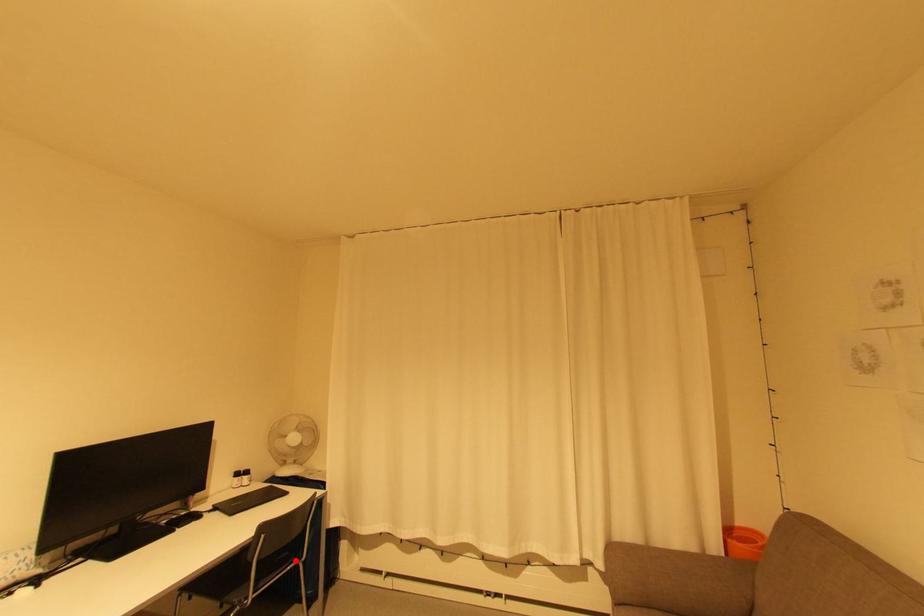
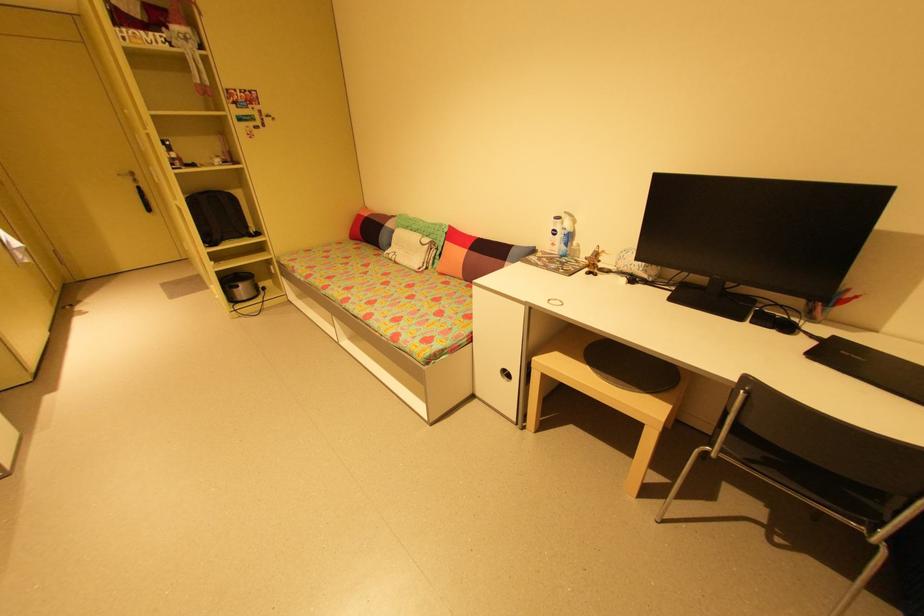
Question: I am providing you with two images of the same scene from different viewpoints. A red point is shown in image1. For the corresponding object point in image2, is it positioned nearer or farther from the camera?

Choices:
 (A) Nearer
 (B) Farther

Answer: (B)